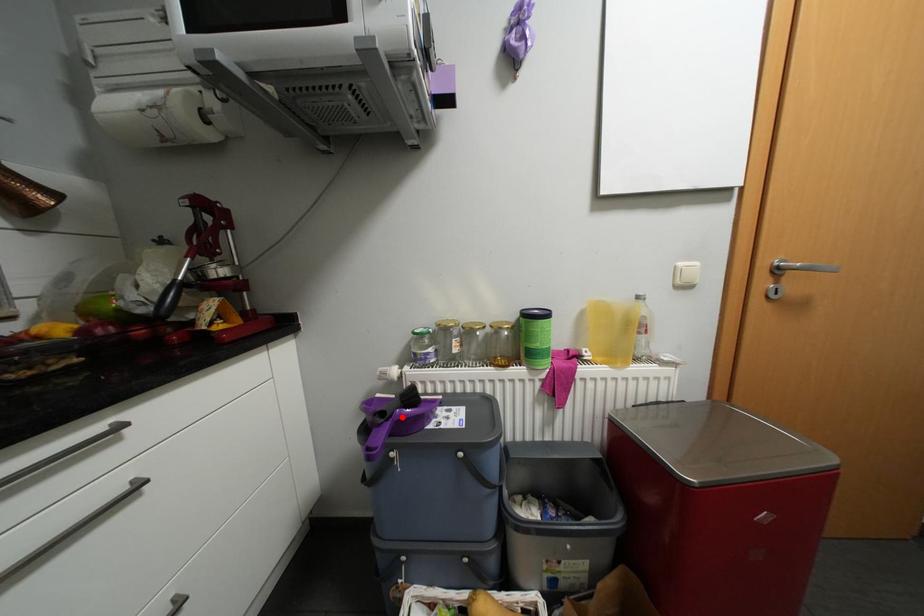
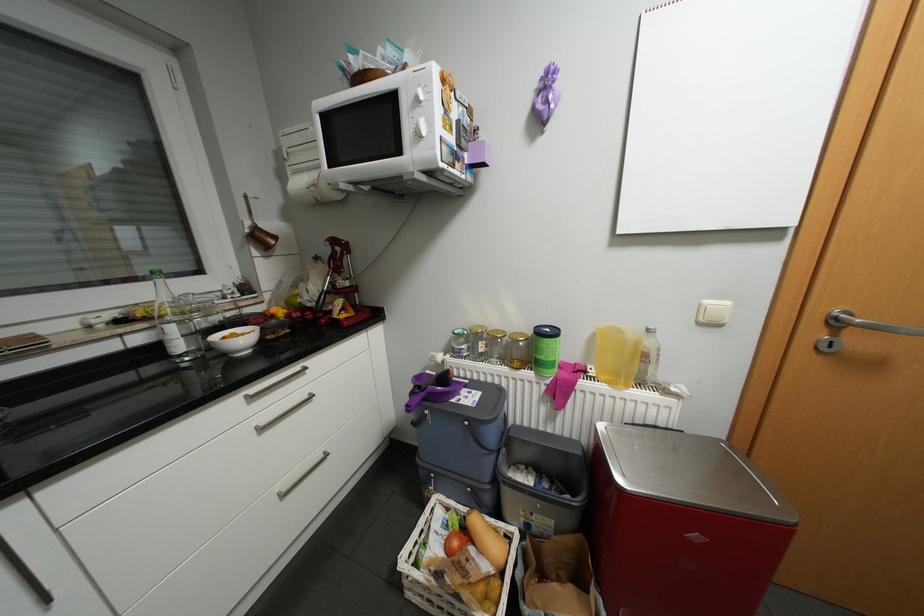
Locate, in the second image, the point that corresponds to the highlighted location in the first image.

(441, 389)